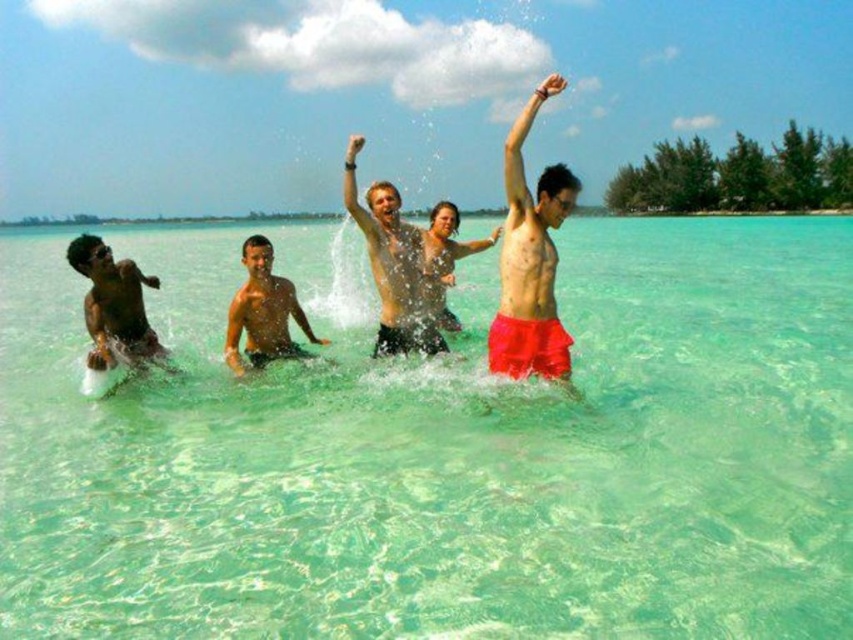
Question: Which point is closer to the camera?

Choices:
 (A) smooth skin man at center
 (B) smooth black shorts at center
 (C) red matte shorts at center

Answer: (C)

Question: Does red matte shorts at center appear under smooth black shorts at center?

Choices:
 (A) no
 (B) yes

Answer: (A)

Question: Among these points, which one is farthest from the camera?

Choices:
 (A) (245, 342)
 (B) (384, 211)

Answer: (A)

Question: Is red matte shorts at center in front of smooth black shorts at center?

Choices:
 (A) no
 (B) yes

Answer: (B)

Question: Does clear water at center have a lesser width compared to matte black man at left?

Choices:
 (A) yes
 (B) no

Answer: (B)

Question: Considering the real-world distances, which object is closest to the clear water at center?

Choices:
 (A) smooth skin man at center
 (B) matte black man at left
 (C) red matte shorts at center
 (D) smooth black shorts at center

Answer: (D)